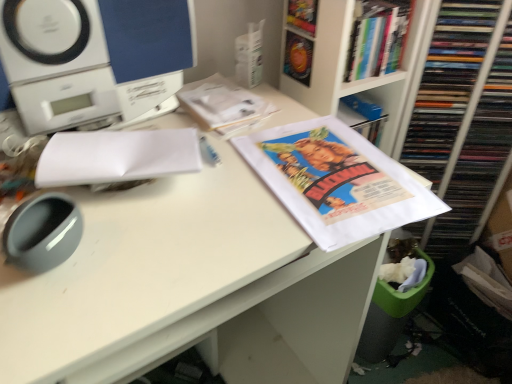
The image size is (512, 384). Find the location of `vacant space situated above white paper at left (from a real-world perspective)`. vacant space situated above white paper at left (from a real-world perspective) is located at coordinates (116, 147).